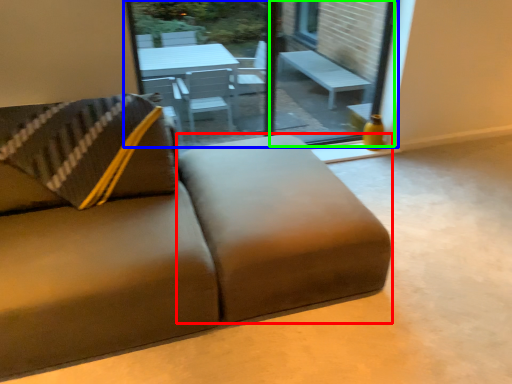
Question: Considering the real-world distances, which object is closest to footrest (highlighted by a red box)? window (highlighted by a blue box) or window screen (highlighted by a green box).

Choices:
 (A) window
 (B) window screen

Answer: (A)